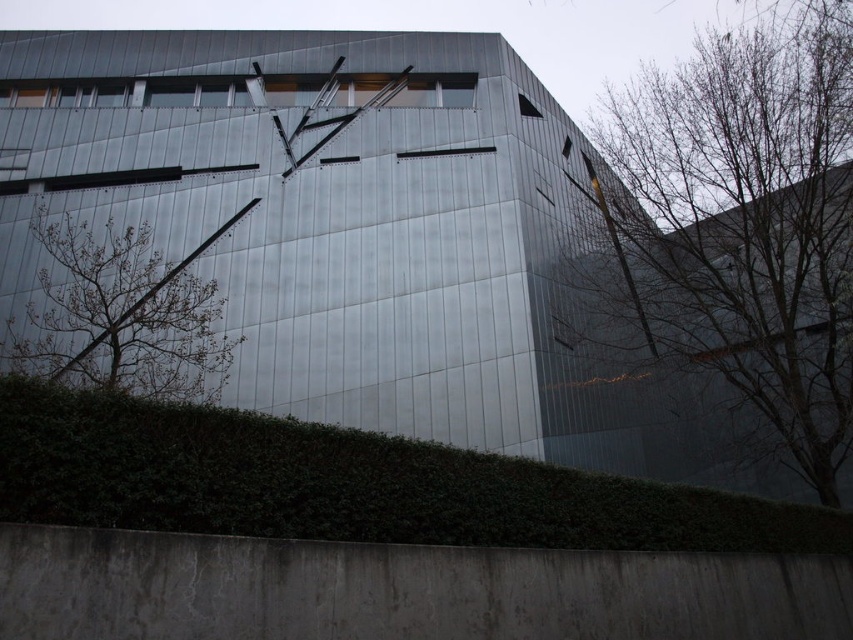
You are standing in front of the building and want to take a photo of both the bare branches at right and the green leafy hedge at lower center. Which one is located to the right of the other?

The bare branches at right is positioned on the right side of green leafy hedge at lower center.

You are standing in front of the building and notice two sets of bare branches. Which set is closer to you, the bare branches at left or the bare branches at right?

The bare branches at right is closer to you because the bare branches at left is behind it.

You are a landscape architect evaluating the space in front of the modern building. You need to determine which area has more room for additional plants. Based on the image, which object between the green leafy hedge at lower center and the bare branches at left has more space available for planting?

The bare branches at left has more space available for planting since the green leafy hedge at lower center occupies less space than the bare branches at left.